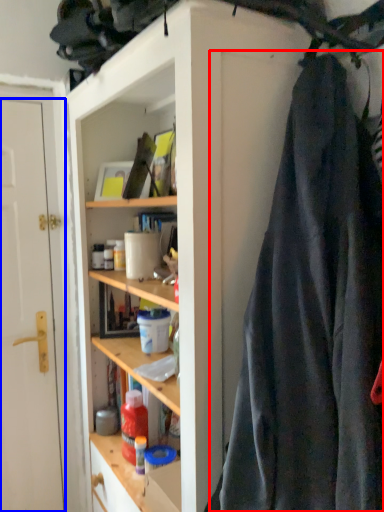
Question: Which object is further to the camera taking this photo, clothing (highlighted by a red box) or door (highlighted by a blue box)?

Choices:
 (A) clothing
 (B) door

Answer: (B)